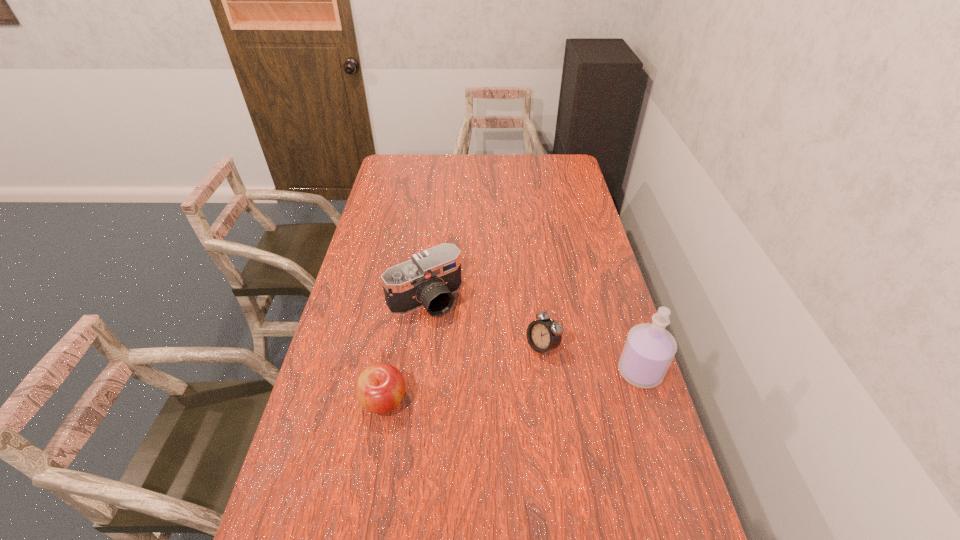
Where is `vacant space at the right edge of the desktop`? vacant space at the right edge of the desktop is located at coordinates (570, 254).

Image resolution: width=960 pixels, height=540 pixels. In the image, there is a desktop. What are the coordinates of `free space at the far left corner` in the screenshot? It's located at (395, 164).

Identify the location of free space between the apple and the alarm clock. The height and width of the screenshot is (540, 960). (464, 374).

Where is `free area in between the tallest object and the alarm clock`? This screenshot has width=960, height=540. free area in between the tallest object and the alarm clock is located at coordinates tap(591, 359).

Where is `free spot between the rightmost object and the apple`? Image resolution: width=960 pixels, height=540 pixels. free spot between the rightmost object and the apple is located at coordinates (512, 386).

You are a GUI agent. You are given a task and a screenshot of the screen. Output one action in this format:
    pyautogui.click(x=<x>, y=<y>)
    Task: Click on the vacant area that lies between the apple and the rightmost object
    This screenshot has width=960, height=540.
    Given the screenshot: What is the action you would take?
    pyautogui.click(x=512, y=386)

Locate an element on the screen. empty location between the tallest object and the apple is located at coordinates (512, 386).

The width and height of the screenshot is (960, 540). I want to click on vacant space that's between the apple and the tallest object, so click(x=512, y=386).

Identify the location of free space between the camera and the apple. This screenshot has width=960, height=540. (404, 350).

Locate an element on the screen. Image resolution: width=960 pixels, height=540 pixels. object that stands as the second closest to the camera is located at coordinates (380, 387).